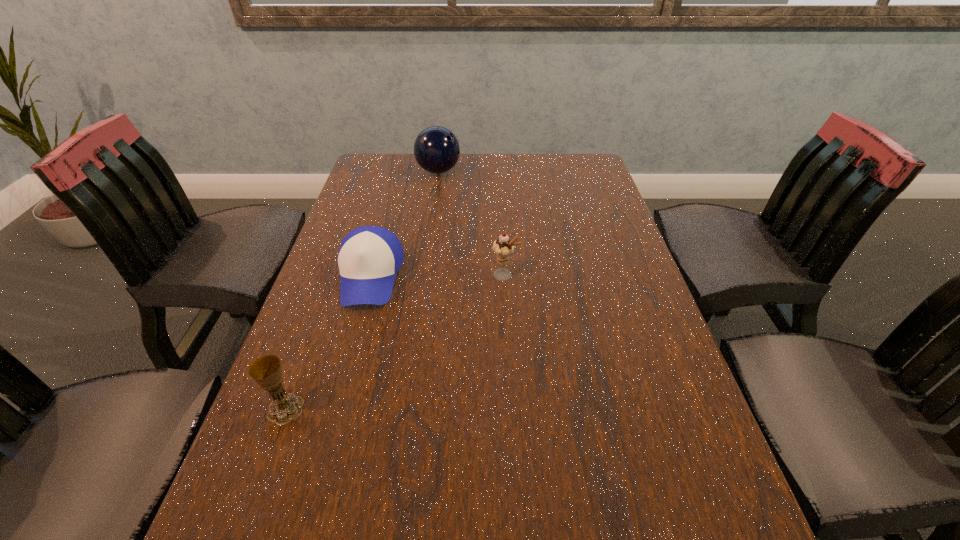
Locate an element on the screen. bowling ball is located at coordinates (436, 149).

Locate an element on the screen. icecream is located at coordinates (503, 247).

The width and height of the screenshot is (960, 540). Identify the location of the third tallest object. (266, 371).

You are a GUI agent. You are given a task and a screenshot of the screen. Output one action in this format:
    pyautogui.click(x=<x>, y=<y>)
    Task: Click on the chalice
    The image size is (960, 540).
    Given the screenshot: What is the action you would take?
    pyautogui.click(x=266, y=371)

You are a GUI agent. You are given a task and a screenshot of the screen. Output one action in this format:
    pyautogui.click(x=<x>, y=<y>)
    Task: Click on the shortest object
    
    Given the screenshot: What is the action you would take?
    pyautogui.click(x=369, y=257)

This screenshot has width=960, height=540. Find the location of `free space located 0.150m on the surface of the farthest object near the finger holes`. free space located 0.150m on the surface of the farthest object near the finger holes is located at coordinates (506, 171).

Locate an element on the screen. free space located 0.190m on the left of the icecream is located at coordinates (412, 275).

I want to click on free space located 0.140m on the front of the chalice, so click(249, 509).

At what (x,y) coordinates should I click in order to perform the action: click on free region located 0.140m on the front-facing side of the shortest object. Please return your answer as a coordinate pair (x, y). The height and width of the screenshot is (540, 960). Looking at the image, I should click on [346, 364].

This screenshot has width=960, height=540. Find the location of `object situated at the far edge`. object situated at the far edge is located at coordinates (436, 149).